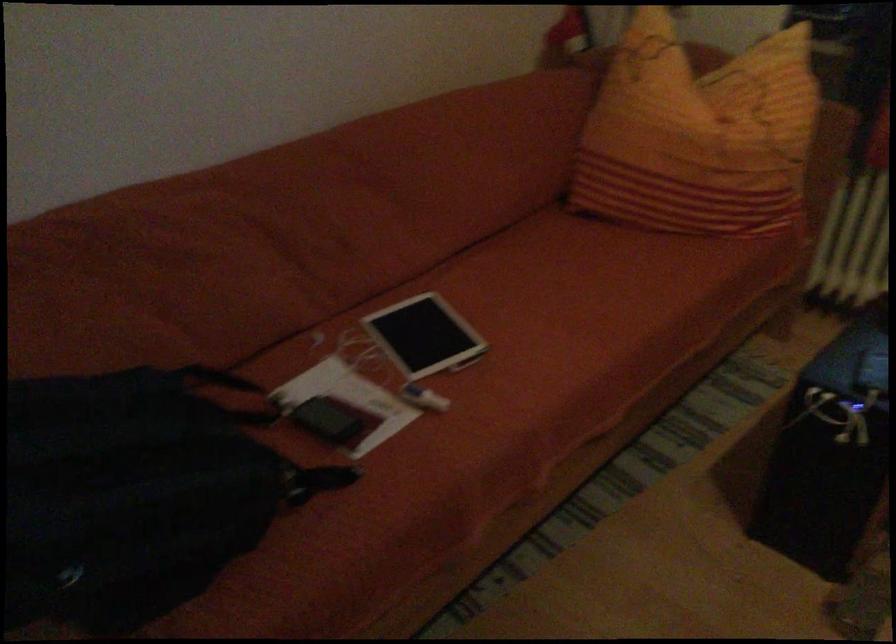
Image resolution: width=896 pixels, height=644 pixels. I want to click on sofa sitting surface, so click(574, 323).